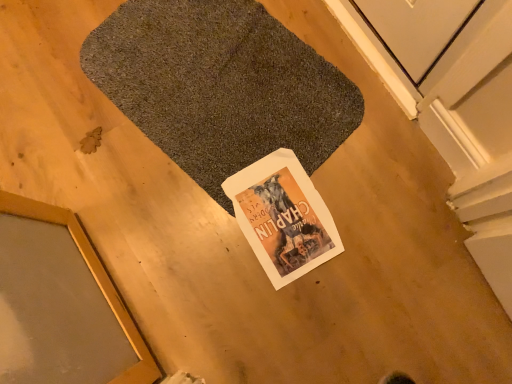
You are a GUI agent. You are given a task and a screenshot of the screen. Output one action in this format:
    pyautogui.click(x=<x>, y=<y>)
    Task: Click on the vacant area situated to the left side of dark gray carpet at center
    Image resolution: width=512 pixels, height=384 pixels.
    Given the screenshot: What is the action you would take?
    pyautogui.click(x=84, y=127)